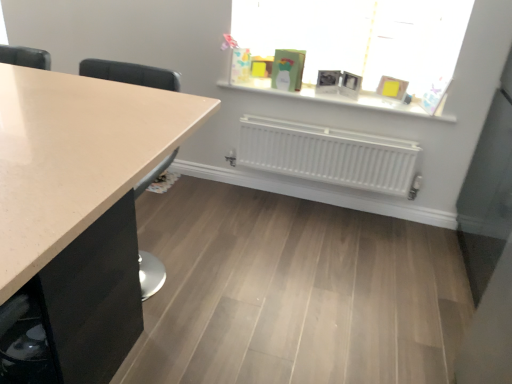
Where is `vacant region below white matte radiator at center (from a real-world perspective)`? The height and width of the screenshot is (384, 512). vacant region below white matte radiator at center (from a real-world perspective) is located at coordinates (308, 197).